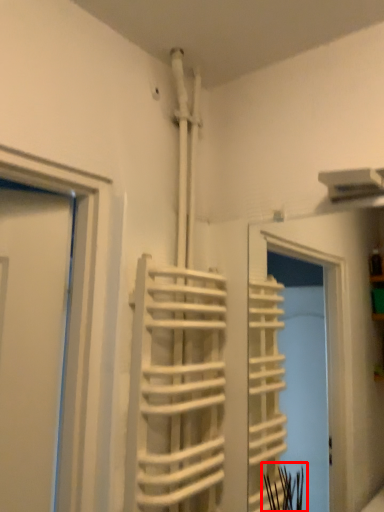
Question: From the image's perspective, where is plant (annotated by the red box) located relative to stair?

Choices:
 (A) above
 (B) below

Answer: (B)